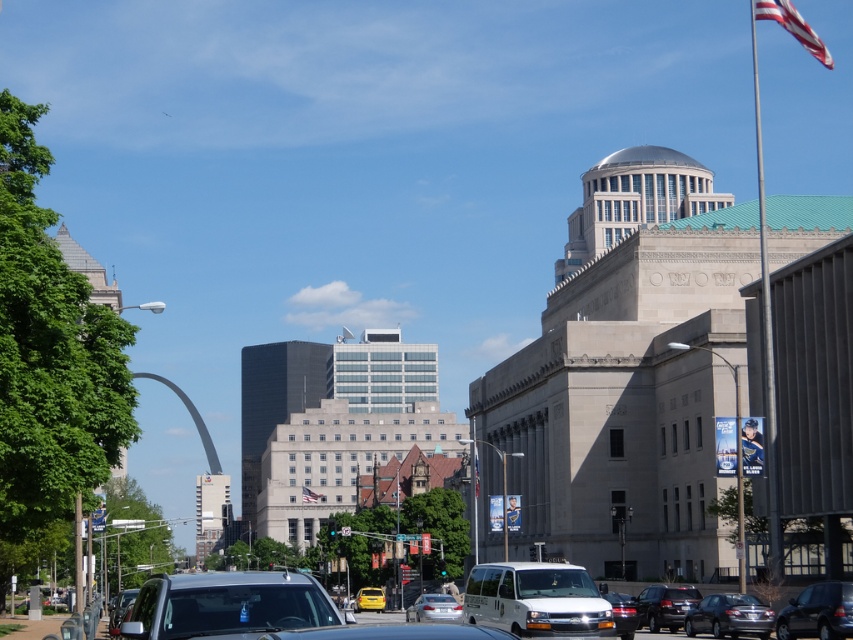
Is matte black car at lower right below shiny black sedan at lower right?

Actually, matte black car at lower right is above shiny black sedan at lower right.

Who is taller, matte black car at lower right or shiny black sedan at lower right?

With more height is matte black car at lower right.

Who is more distant from viewer, (787, 612) or (646, 596)?

The point (646, 596) is behind.

I want to click on matte black car at lower right, so click(x=817, y=612).

Who is lower down, white matte van at center or red fabric flag at upper right?

white matte van at center is lower down.

You are a GUI agent. You are given a task and a screenshot of the screen. Output one action in this format:
    pyautogui.click(x=<x>, y=<y>)
    Task: Click on the white matte van at center
    
    Given the screenshot: What is the action you would take?
    pyautogui.click(x=537, y=600)

At what (x,y) coordinates should I click in order to perform the action: click on white matte van at center. Please return your answer as a coordinate pair (x, y). Looking at the image, I should click on (537, 600).

Is matte black car at lower right wider than shiny silver sedan at lower right?

Yes.

Is the position of matte black car at lower right more distant than that of shiny silver sedan at lower right?

No.

Describe the element at coordinates (817, 612) in the screenshot. I see `matte black car at lower right` at that location.

Where is `matte black car at lower right`? The height and width of the screenshot is (640, 853). matte black car at lower right is located at coordinates (817, 612).